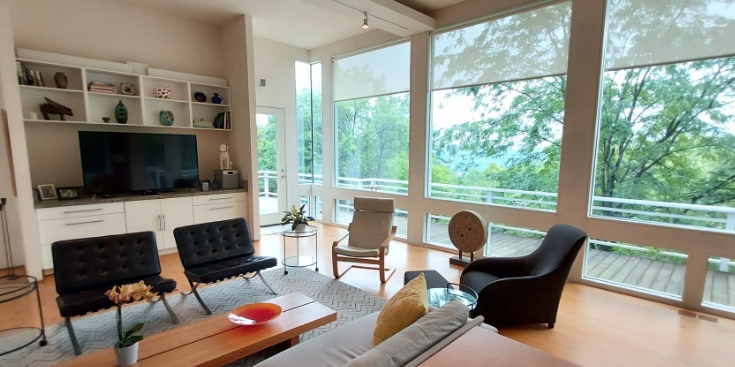
You are a GUI agent. You are given a task and a screenshot of the screen. Output one action in this format:
    pyautogui.click(x=<x>, y=<y>)
    Task: Click on the shelf
    
    Given the screenshot: What is the action you would take?
    pyautogui.click(x=128, y=103), pyautogui.click(x=146, y=215)